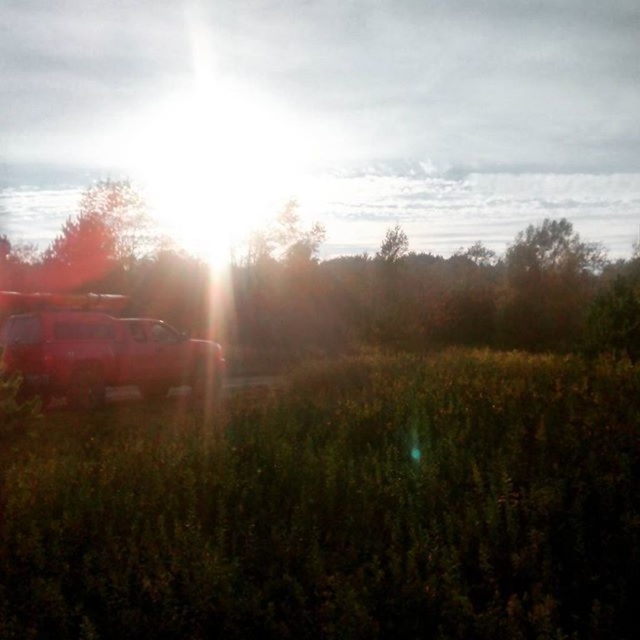
You are standing in the middle of the field of tall grasses or wildflowers and want to walk towards the green leafy tree at left. In which direction should you go?

You should walk towards the left direction to reach the green leafy tree at left since it is positioned at point 0.447 on the x axis which is to the left side of the frame.